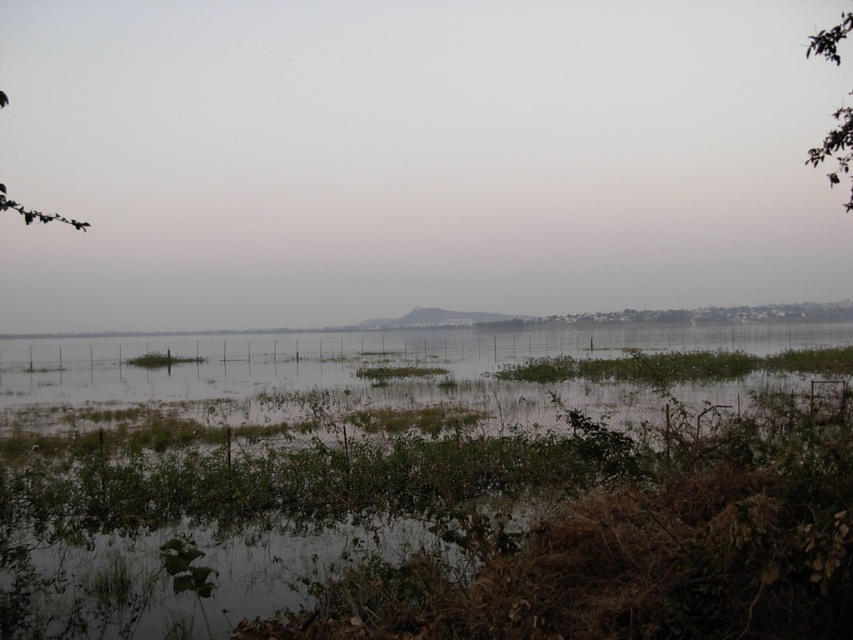
You are an ornithologist observing this wetland scene. You notice the green leafy tree at upper right and the green leafy branch at upper left. Which of these two has a larger size?

The green leafy tree at upper right is bigger than the green leafy branch at upper left.

You are standing at the point with coordinates point (x=810, y=161) and want to walk to point (x=51, y=216). Given the wetland terrain described, will you be able to walk directly towards your destination without obstacles?

Point (x=810, y=161) is in front of point (x=51, y=216), so there are no obstacles blocking the path between them. Therefore, you can walk directly towards the destination without any hindrance.